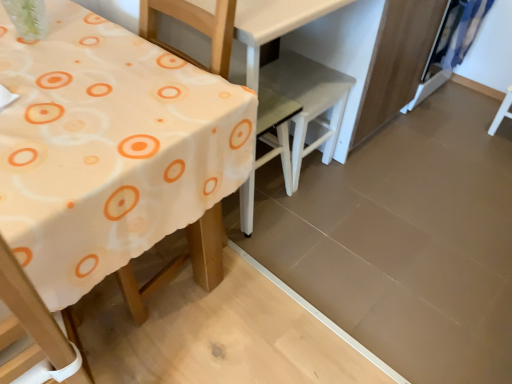
Question: Is blue fabric curtain at upper right wider than white plastic chair at center, the first chair in the right-to-left sequence?

Choices:
 (A) no
 (B) yes

Answer: (A)

Question: Is blue fabric curtain at upper right closer to camera compared to white plastic chair at center, the first chair in the right-to-left sequence?

Choices:
 (A) no
 (B) yes

Answer: (A)

Question: Would you say blue fabric curtain at upper right is outside white plastic chair at center, the second chair when ordered from left to right?

Choices:
 (A) yes
 (B) no

Answer: (A)

Question: Are blue fabric curtain at upper right and white plastic chair at center, the first chair in the right-to-left sequence, located far from each other?

Choices:
 (A) yes
 (B) no

Answer: (B)

Question: Considering the relative sizes of blue fabric curtain at upper right and white plastic chair at center, the second chair when ordered from left to right, in the image provided, is blue fabric curtain at upper right smaller than white plastic chair at center, the second chair when ordered from left to right,?

Choices:
 (A) yes
 (B) no

Answer: (A)

Question: From their relative heights in the image, would you say white fabric table at left is taller or shorter than white plastic chair at center, the second chair from the right?

Choices:
 (A) tall
 (B) short

Answer: (A)

Question: Does point (172, 203) appear closer or farther from the camera than point (249, 235)?

Choices:
 (A) closer
 (B) farther

Answer: (A)

Question: Based on their positions, is white fabric table at left located to the left or right of white plastic chair at center, arranged as the first chair when viewed from the left?

Choices:
 (A) left
 (B) right

Answer: (A)

Question: Is white fabric table at left inside or outside of white plastic chair at center, arranged as the first chair when viewed from the left?

Choices:
 (A) inside
 (B) outside

Answer: (B)

Question: Considering their positions, is blue fabric curtain at upper right located in front of or behind white plastic chair at center, arranged as the first chair when viewed from the left?

Choices:
 (A) front
 (B) behind

Answer: (B)

Question: Would you say blue fabric curtain at upper right is to the left or to the right of white plastic chair at center, the second chair from the right, in the picture?

Choices:
 (A) left
 (B) right

Answer: (B)

Question: Is blue fabric curtain at upper right bigger or smaller than white plastic chair at center, arranged as the first chair when viewed from the left?

Choices:
 (A) small
 (B) big

Answer: (A)

Question: From the image's perspective, relative to white plastic chair at center, arranged as the first chair when viewed from the left, is blue fabric curtain at upper right above or below?

Choices:
 (A) below
 (B) above

Answer: (B)

Question: In terms of width, does white plastic chair at center, the first chair in the right-to-left sequence, look wider or thinner when compared to white plastic chair at center, the second chair from the right?

Choices:
 (A) thin
 (B) wide

Answer: (B)

Question: Choose the correct answer: Is white plastic chair at center, the first chair in the right-to-left sequence, inside white plastic chair at center, the second chair from the right, or outside it?

Choices:
 (A) inside
 (B) outside

Answer: (B)